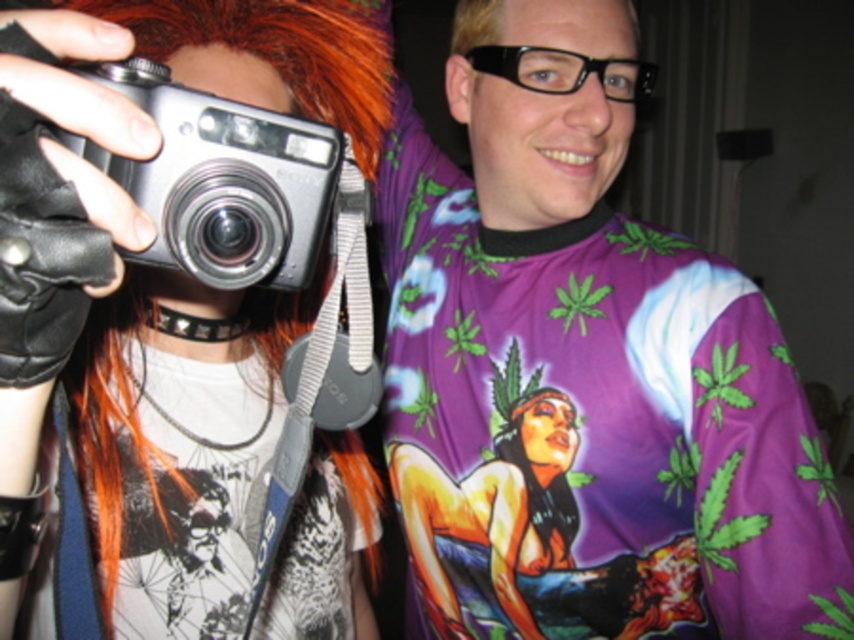
What object is located at the coordinate point (170,284) in the image?

The point (170,284) corresponds to the matte black camera at center.

You are a photographer trying to set up two cameras for a dual shot. The matte black camera at center and the silver metallic camera at left are both in your frame. If you want to ensure both cameras are visible in your photo, what is the minimum distance you should keep between them?

The minimum distance between the matte black camera at center and the silver metallic camera at left should be at least 7.86 inches to ensure both are visible in the photo.

You are a photographer trying to decide which camera to use for a portrait shoot. You notice the matte black camera at center and the silver metallic camera at left. Which camera is located lower in the image?

The matte black camera at center is positioned under the silver metallic camera at left, so it is located lower in the image.